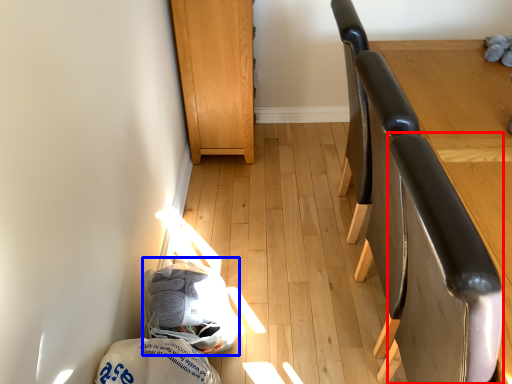
Question: Which of the following is the closest to the observer, swivel chair (highlighted by a red box) or material (highlighted by a blue box)?

Choices:
 (A) swivel chair
 (B) material

Answer: (A)